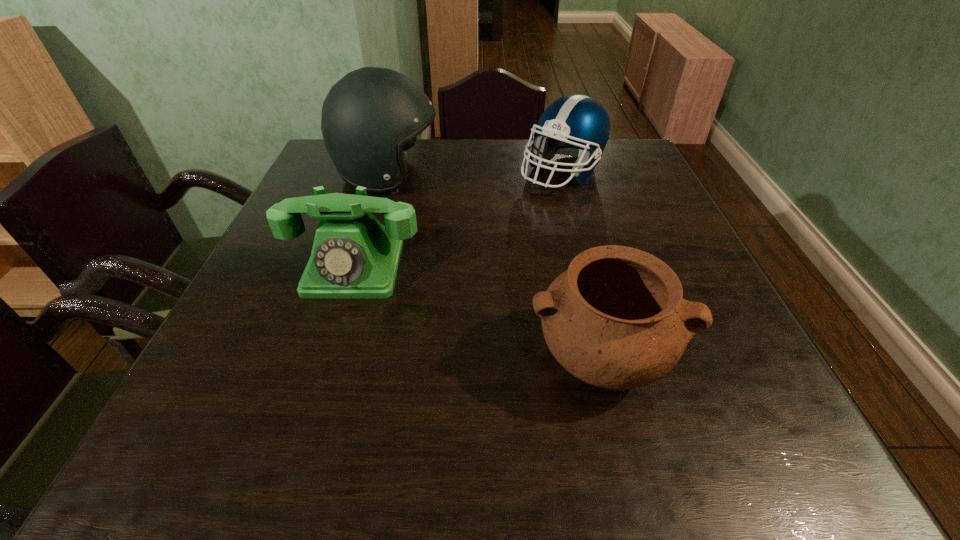
Where is `free space that satisfies the following two spatial constraints: 1. at the face opening of the left football helmet; 2. on the back side of the pottery`? This screenshot has height=540, width=960. free space that satisfies the following two spatial constraints: 1. at the face opening of the left football helmet; 2. on the back side of the pottery is located at coordinates (333, 359).

You are a GUI agent. You are given a task and a screenshot of the screen. Output one action in this format:
    pyautogui.click(x=<x>, y=<y>)
    Task: Click on the free space that satisfies the following two spatial constraints: 1. on the dial of the nearest object; 2. on the right side of the second nearest object
    
    Given the screenshot: What is the action you would take?
    pyautogui.click(x=325, y=359)

I want to click on vacant region that satisfies the following two spatial constraints: 1. at the face opening of the nearest object; 2. on the left side of the left football helmet, so click(333, 359).

You are a GUI agent. You are given a task and a screenshot of the screen. Output one action in this format:
    pyautogui.click(x=<x>, y=<y>)
    Task: Click on the free space that satisfies the following two spatial constraints: 1. at the face opening of the tallest object; 2. on the right side of the pottery
    The image size is (960, 540).
    Given the screenshot: What is the action you would take?
    pyautogui.click(x=333, y=359)

The image size is (960, 540). In order to click on vacant space that satisfies the following two spatial constraints: 1. at the front of the shorter football helmet with the faceguard; 2. at the face opening of the taller football helmet in this screenshot , I will do `click(564, 176)`.

Where is `free space in the image that satisfies the following two spatial constraints: 1. at the front of the shorter football helmet with the faceguard; 2. at the face opening of the taller football helmet`? This screenshot has height=540, width=960. free space in the image that satisfies the following two spatial constraints: 1. at the front of the shorter football helmet with the faceguard; 2. at the face opening of the taller football helmet is located at coordinates (564, 176).

Locate an element on the screen. The height and width of the screenshot is (540, 960). vacant position in the image that satisfies the following two spatial constraints: 1. at the front of the shorter football helmet with the faceguard; 2. at the face opening of the tallest object is located at coordinates pos(564,176).

Where is `free point that satisfies the following two spatial constraints: 1. at the front of the right football helmet with the faceguard; 2. at the face opening of the tallest object`? This screenshot has width=960, height=540. free point that satisfies the following two spatial constraints: 1. at the front of the right football helmet with the faceguard; 2. at the face opening of the tallest object is located at coordinates (564, 176).

Locate an element on the screen. This screenshot has width=960, height=540. vacant space that satisfies the following two spatial constraints: 1. at the face opening of the pottery; 2. on the right side of the taller football helmet is located at coordinates (333, 359).